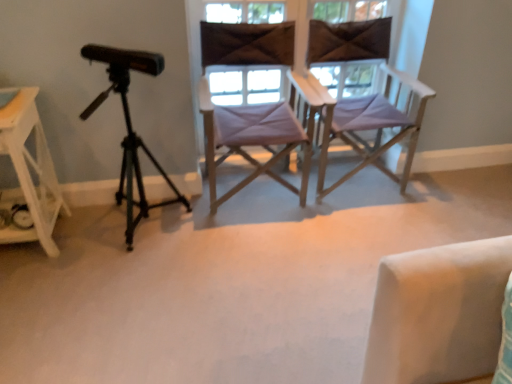
Question: From a real-world perspective, is purple fabric chair at center, marked as the 2th chair in a right-to-left arrangement, positioned over matte purple chair at center, which ranks as the 1th window in right-to-left order, based on gravity?

Choices:
 (A) yes
 (B) no

Answer: (B)

Question: Is purple fabric chair at center, marked as the 2th chair in a right-to-left arrangement, positioned behind matte purple chair at center, which ranks as the 1th window in right-to-left order?

Choices:
 (A) yes
 (B) no

Answer: (B)

Question: Does purple fabric chair at center, marked as the 2th chair in a right-to-left arrangement, have a smaller size compared to matte purple chair at center, which ranks as the 1th window in right-to-left order?

Choices:
 (A) yes
 (B) no

Answer: (B)

Question: Considering the relative sizes of purple fabric chair at center, arranged as the first chair when viewed from the left, and matte purple chair at center, which ranks as the 1th window in right-to-left order, in the image provided, is purple fabric chair at center, arranged as the first chair when viewed from the left, shorter than matte purple chair at center, which ranks as the 1th window in right-to-left order,?

Choices:
 (A) yes
 (B) no

Answer: (B)

Question: Is purple fabric chair at center, marked as the 2th chair in a right-to-left arrangement, located outside matte purple chair at center, placed as the 2th window when sorted from left to right?

Choices:
 (A) yes
 (B) no

Answer: (A)

Question: Considering the relative sizes of purple fabric chair at center, arranged as the first chair when viewed from the left, and matte purple chair at center, placed as the 2th window when sorted from left to right, in the image provided, is purple fabric chair at center, arranged as the first chair when viewed from the left, wider than matte purple chair at center, placed as the 2th window when sorted from left to right,?

Choices:
 (A) no
 (B) yes

Answer: (B)

Question: Considering the relative positions of matte purple chair at center, placed as the 2th window when sorted from left to right, and white wood side table at left in the image provided, is matte purple chair at center, placed as the 2th window when sorted from left to right, behind white wood side table at left?

Choices:
 (A) no
 (B) yes

Answer: (B)

Question: From the image's perspective, is matte purple chair at center, placed as the 2th window when sorted from left to right, below white wood side table at left?

Choices:
 (A) no
 (B) yes

Answer: (A)

Question: Can you confirm if matte purple chair at center, which ranks as the 1th window in right-to-left order, is positioned to the right of white wood side table at left?

Choices:
 (A) yes
 (B) no

Answer: (A)

Question: Considering the relative sizes of matte purple chair at center, placed as the 2th window when sorted from left to right, and white wood side table at left in the image provided, is matte purple chair at center, placed as the 2th window when sorted from left to right, smaller than white wood side table at left?

Choices:
 (A) yes
 (B) no

Answer: (A)

Question: From the image's perspective, does matte purple chair at center, placed as the 2th window when sorted from left to right, appear higher than white wood side table at left?

Choices:
 (A) yes
 (B) no

Answer: (A)

Question: Does matte purple chair at center, which ranks as the 1th window in right-to-left order, have a greater height compared to white wood side table at left?

Choices:
 (A) yes
 (B) no

Answer: (B)

Question: Is black matte tripod at left with brown fabric at center, arranged as the 1th window when viewed from the left?

Choices:
 (A) no
 (B) yes

Answer: (A)